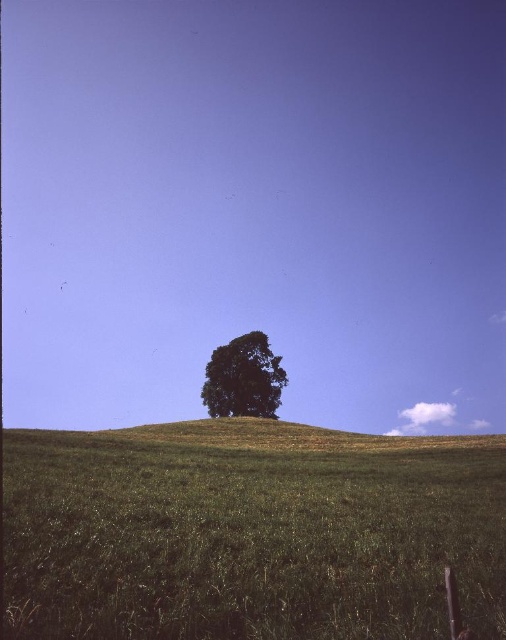
Between point (40, 458) and point (257, 396), which one is positioned in front?

Point (40, 458)

Is point (398, 480) farther from camera compared to point (227, 396)?

No, it is not.

Which is in front, point (22, 588) or point (263, 400)?

Point (22, 588) is more forward.

Where is `green grassy hill at center`? This screenshot has width=506, height=640. green grassy hill at center is located at coordinates tap(249, 532).